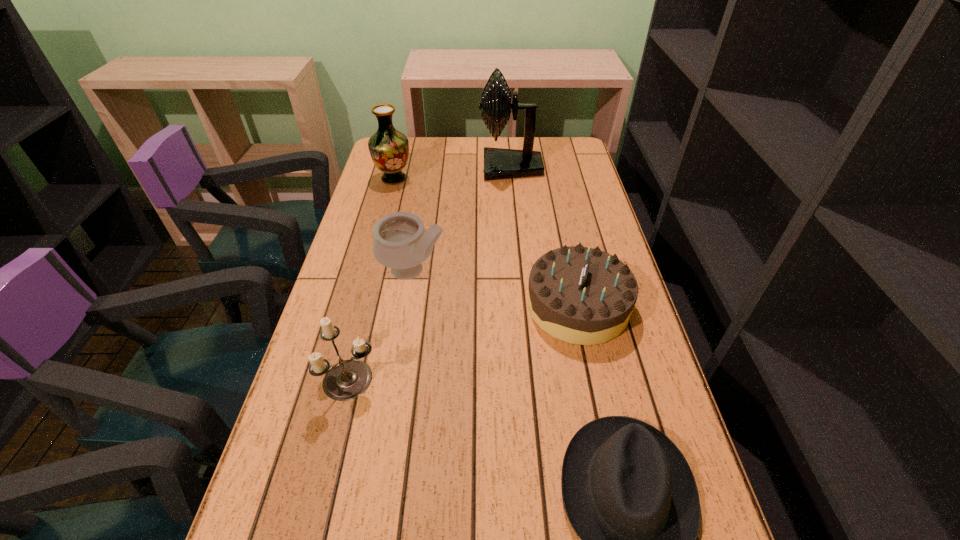
Where is `free space located 0.050m on the front of the candle holder`? The image size is (960, 540). free space located 0.050m on the front of the candle holder is located at coordinates (340, 428).

This screenshot has width=960, height=540. I want to click on free point located on the front-facing side of the second shortest object, so click(x=409, y=306).

The image size is (960, 540). I want to click on free space located 0.160m on the front-facing side of the second shortest object, so click(464, 306).

At what (x,y) coordinates should I click in order to perform the action: click on free space located 0.100m on the front-facing side of the second shortest object. Please return your answer as a coordinate pair (x, y). This screenshot has width=960, height=540. Looking at the image, I should click on (488, 306).

Identify the location of object that is at the far edge. (499, 163).

Locate an element on the screen. This screenshot has height=540, width=960. vase that is positioned at the left edge is located at coordinates (389, 148).

Where is `pottery located at the left edge`? pottery located at the left edge is located at coordinates (400, 242).

The image size is (960, 540). I want to click on candle holder present at the left edge, so click(348, 379).

Image resolution: width=960 pixels, height=540 pixels. I want to click on object at the right edge, so click(x=580, y=295).

I want to click on free region at the far edge of the desktop, so click(433, 139).